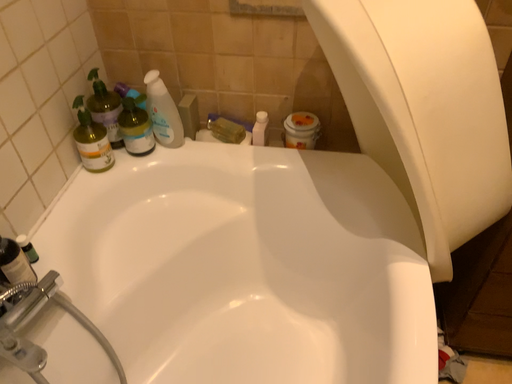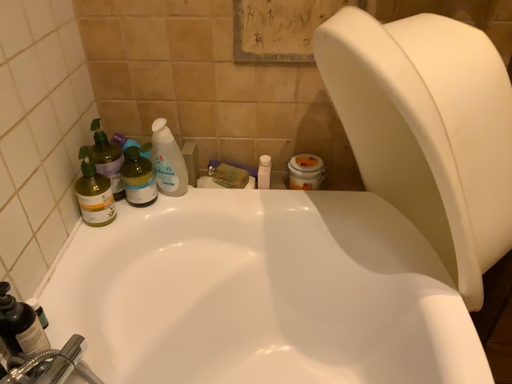
Question: How did the camera likely rotate when shooting the video?

Choices:
 (A) rotated upward
 (B) rotated downward

Answer: (A)